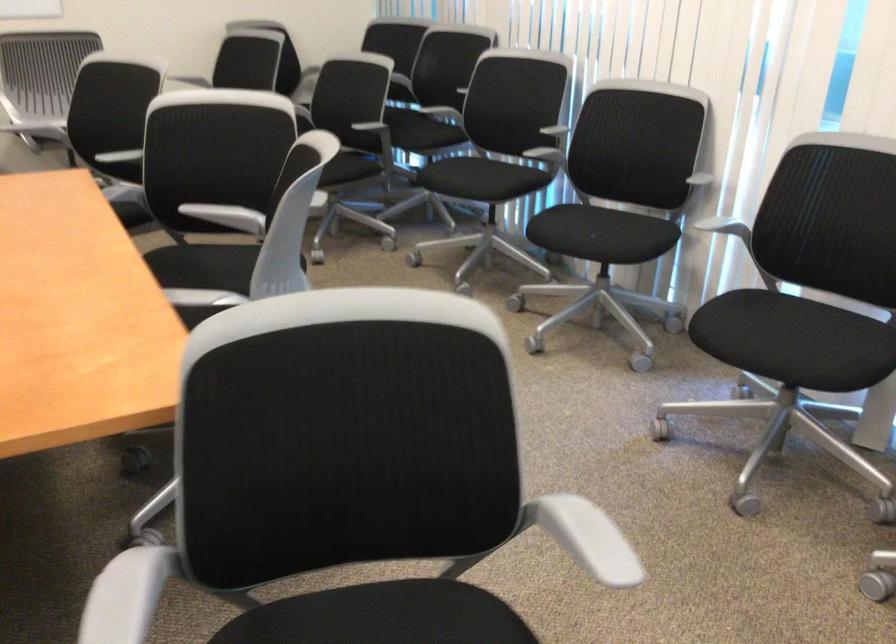
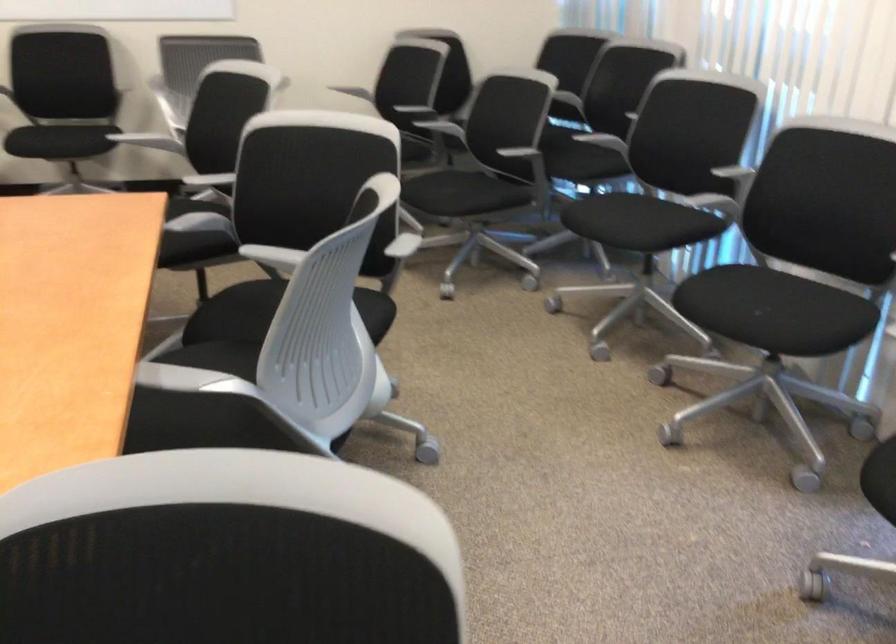
Find the pixel in the second image that matches point (474, 178) in the first image.

(624, 221)